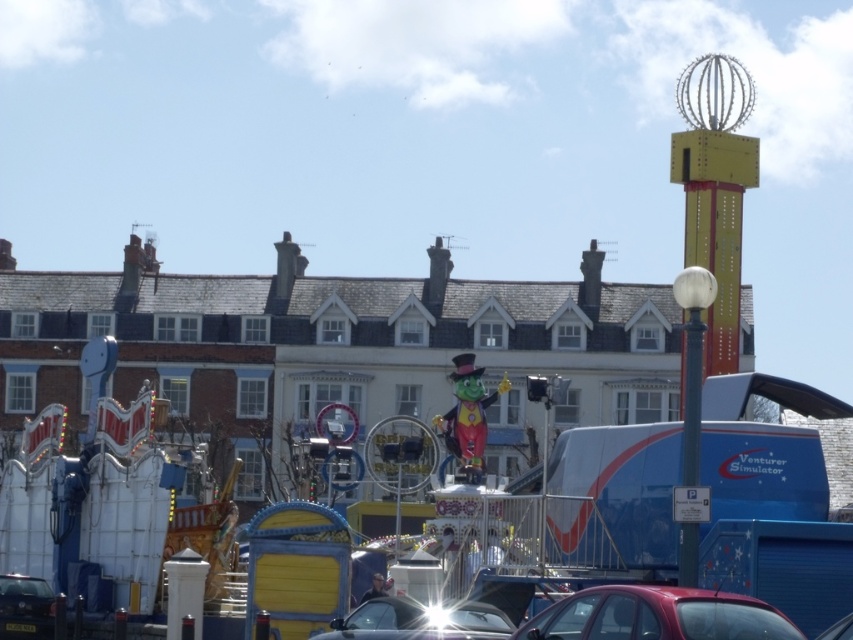
Question: Which of these objects is positioned closest to the shiny black car at center?

Choices:
 (A) shiny black car at lower left
 (B) shiny red car at lower right

Answer: (B)

Question: Observing the image, what is the correct spatial positioning of shiny red car at lower right in reference to shiny black car at lower left?

Choices:
 (A) right
 (B) left

Answer: (A)

Question: Does shiny black car at center have a smaller size compared to shiny black car at lower left?

Choices:
 (A) no
 (B) yes

Answer: (A)

Question: Does shiny black car at center appear on the right side of shiny black car at lower left?

Choices:
 (A) no
 (B) yes

Answer: (B)

Question: Which point is farther to the camera?

Choices:
 (A) (358, 616)
 (B) (573, 618)

Answer: (A)

Question: Which point is closer to the camera?

Choices:
 (A) (4, 609)
 (B) (576, 595)

Answer: (B)